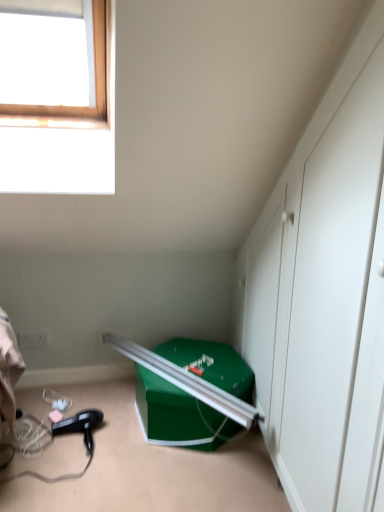
Question: Is black plastic hair dryer at lower left in front of or behind green cardboard box at lower right in the image?

Choices:
 (A) front
 (B) behind

Answer: (B)

Question: In terms of height, does black plastic hair dryer at lower left look taller or shorter compared to green cardboard box at lower right?

Choices:
 (A) short
 (B) tall

Answer: (A)

Question: Would you say black plastic hair dryer at lower left is to the left or to the right of green cardboard box at lower right in the picture?

Choices:
 (A) right
 (B) left

Answer: (B)

Question: Considering the positions of point (180, 347) and point (87, 425), is point (180, 347) closer or farther from the camera than point (87, 425)?

Choices:
 (A) farther
 (B) closer

Answer: (A)

Question: From a real-world perspective, is green cardboard box at lower right above or below black plastic hair dryer at lower left?

Choices:
 (A) below
 (B) above

Answer: (B)

Question: Is green cardboard box at lower right wider or thinner than black plastic hair dryer at lower left?

Choices:
 (A) wide
 (B) thin

Answer: (A)

Question: In the image, is green cardboard box at lower right on the left side or the right side of black plastic hair dryer at lower left?

Choices:
 (A) left
 (B) right

Answer: (B)